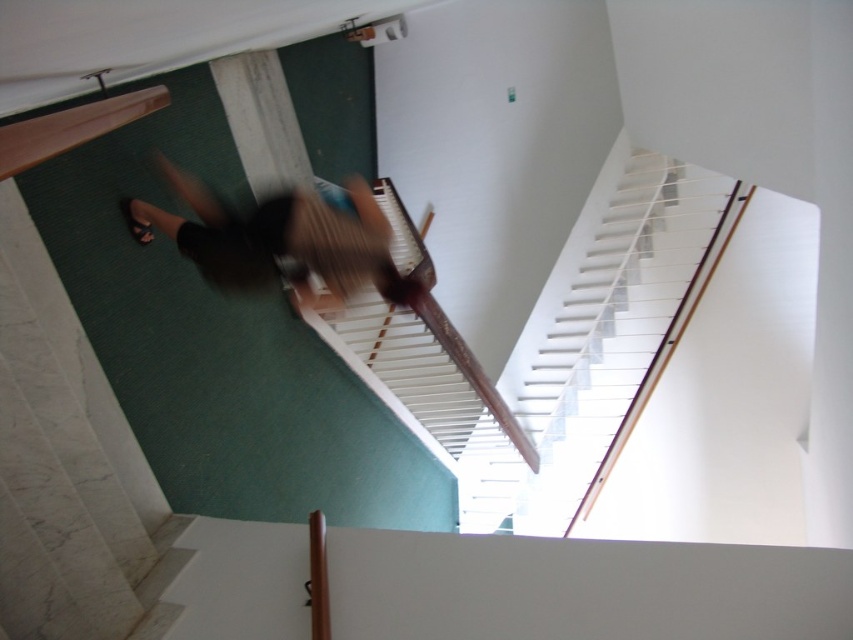
Is white wooden stairs at upper center above blurred black shorts at center?

No.

The image size is (853, 640). What do you see at coordinates (602, 342) in the screenshot?
I see `white wooden stairs at upper center` at bounding box center [602, 342].

Which is behind, point (659, 353) or point (265, 250)?

The point (659, 353) is behind.

You are a GUI agent. You are given a task and a screenshot of the screen. Output one action in this format:
    pyautogui.click(x=<x>, y=<y>)
    Task: Click on the white wooden stairs at upper center
    The image size is (853, 640).
    Given the screenshot: What is the action you would take?
    pyautogui.click(x=602, y=342)